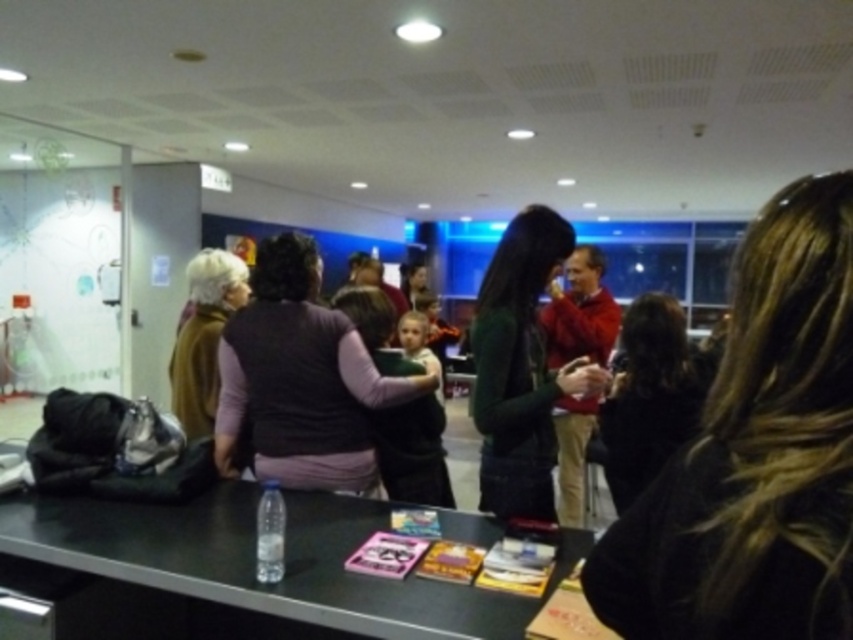
You are attending a networking event and notice two items at the center of the table. The dark green sweater at center and the black fabric hair at center. Which item is positioned to the left when viewed from the front of the table?

The dark green sweater at center is to the left of the black fabric hair at center.

You are at a networking event and see two sweaters on a table. The dark green sweater at center and the brown wool sweater at left. Which one is closer to the right side of the table?

The dark green sweater at center is closer to the right side of the table because it is positioned to the right of the brown wool sweater at left.

You are attending a networking event and want to grab the clear plastic bottle at lower left from the table. However, there is someone with dark brown hair at center blocking your view. Can you reach the bottle without moving the person?

The dark brown hair at center is in front of the clear plastic bottle at lower left, so you cannot directly reach the bottle without moving the person blocking it.